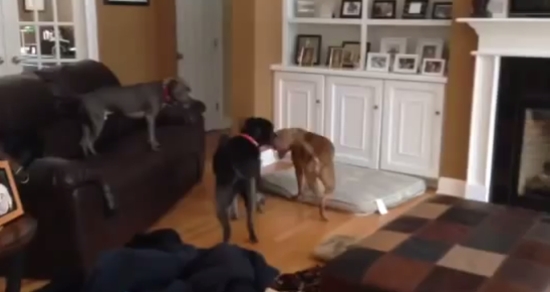
Locate an element on the screen. Image resolution: width=550 pixels, height=292 pixels. plaid cushion is located at coordinates (466, 251).